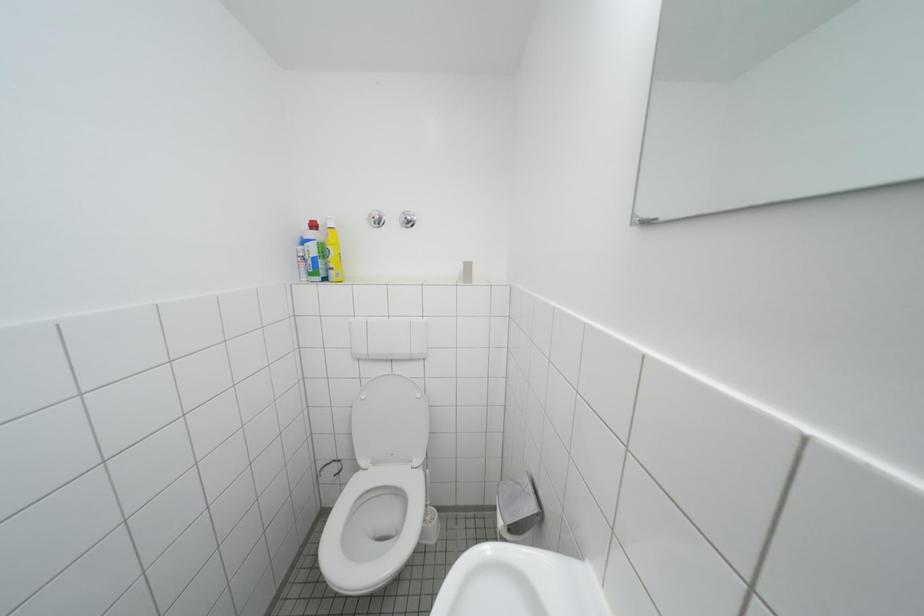
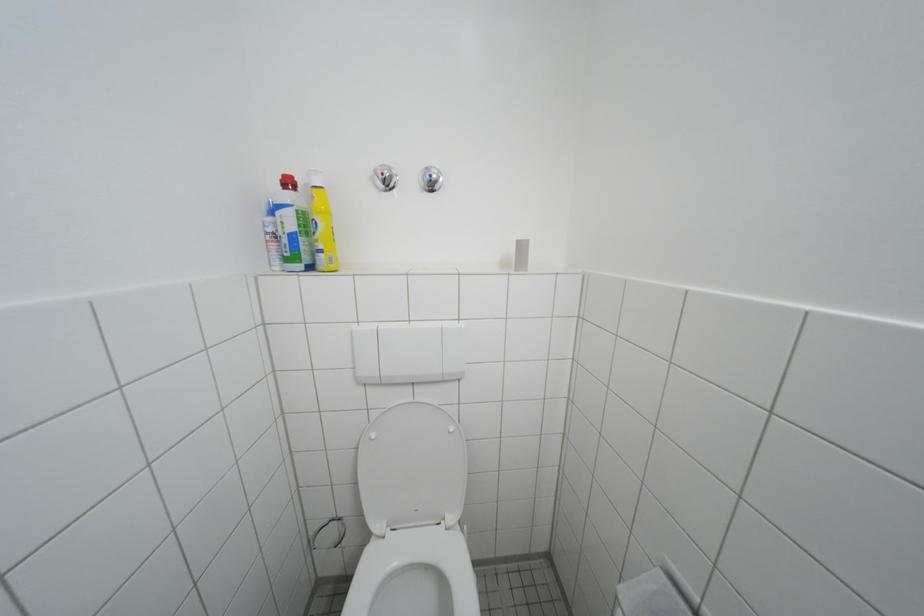
The images are taken continuously from a first-person perspective. In which direction are you moving?

The movement direction of the cameraman is left, forward.